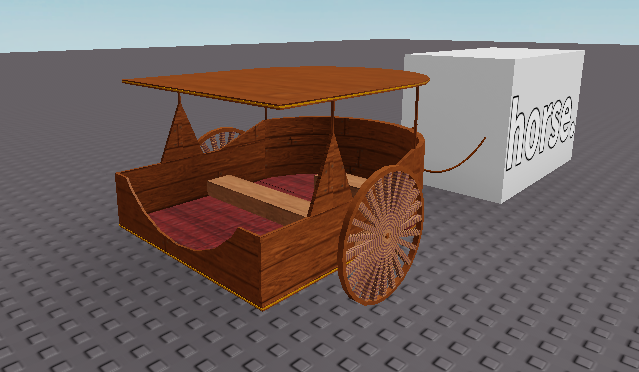
You are a GUI agent. You are given a task and a screenshot of the screen. Output one action in this format:
    pyautogui.click(x=<x>, y=<y>)
    Task: Click on the seat
    
    Given the screenshot: What is the action you would take?
    pyautogui.click(x=227, y=210)